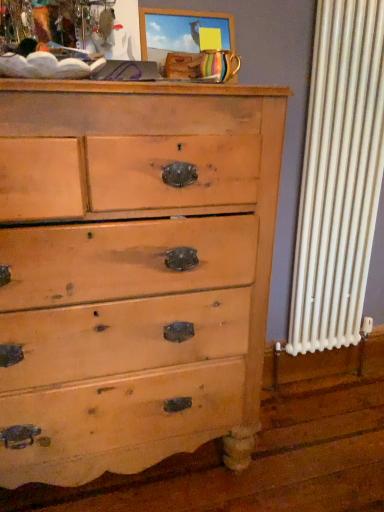
Question: From the image's perspective, relative to light brown wood chest of drawers at center, is wooden picture frame at upper center above or below?

Choices:
 (A) below
 (B) above

Answer: (B)

Question: Does point (183, 48) appear closer or farther from the camera than point (114, 309)?

Choices:
 (A) closer
 (B) farther

Answer: (B)

Question: From a real-world perspective, relative to light brown wood chest of drawers at center, is wooden picture frame at upper center vertically above or below?

Choices:
 (A) above
 (B) below

Answer: (A)

Question: Would you say light brown wood chest of drawers at center is inside or outside wooden picture frame at upper center?

Choices:
 (A) inside
 (B) outside

Answer: (B)

Question: Considering the positions of light brown wood chest of drawers at center and wooden picture frame at upper center in the image, is light brown wood chest of drawers at center wider or thinner than wooden picture frame at upper center?

Choices:
 (A) thin
 (B) wide

Answer: (B)

Question: Is light brown wood chest of drawers at center taller or shorter than wooden picture frame at upper center?

Choices:
 (A) tall
 (B) short

Answer: (A)

Question: In terms of size, does light brown wood chest of drawers at center appear bigger or smaller than wooden picture frame at upper center?

Choices:
 (A) big
 (B) small

Answer: (A)